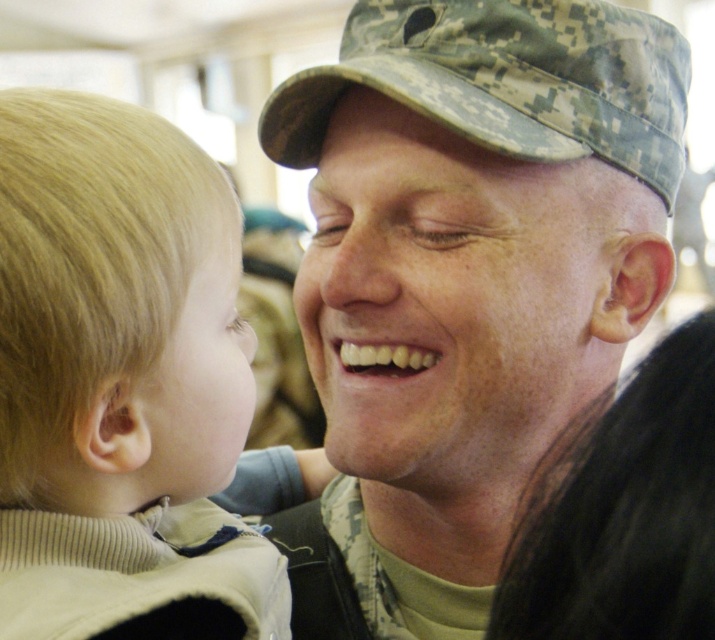
Question: Is blonde hair at left bigger than matte camouflage face at center?

Choices:
 (A) no
 (B) yes

Answer: (A)

Question: Does blonde hair at left have a larger size compared to matte camouflage face at center?

Choices:
 (A) no
 (B) yes

Answer: (A)

Question: Which point is closer to the camera taking this photo?

Choices:
 (A) (217, 328)
 (B) (129, 605)
 (C) (347, 154)

Answer: (B)

Question: Does blonde hair at left have a greater width compared to pale skin/smooth face at left?

Choices:
 (A) yes
 (B) no

Answer: (A)

Question: Which of the following is the closest to the observer?

Choices:
 (A) pale skin/smooth face at left
 (B) blonde hair at left
 (C) camouflage uniform at center
 (D) matte camouflage face at center

Answer: (B)

Question: Which object appears closest to the camera in this image?

Choices:
 (A) blonde hair at left
 (B) pale skin/smooth face at left
 (C) camouflage uniform at center

Answer: (A)